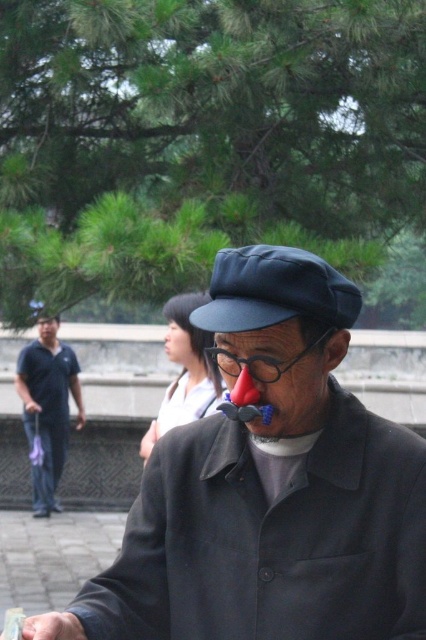
Which is behind, point (264, 540) or point (51, 504)?

The point (51, 504) is more distant.

Locate an element on the screen. The width and height of the screenshot is (426, 640). dark gray matte jacket at center is located at coordinates (270, 538).

Looking at this image, is dark gray matte jacket at center smaller than black fabric cap at center?

Result: No, dark gray matte jacket at center is not smaller than black fabric cap at center.

Is the position of dark gray matte jacket at center more distant than that of black fabric cap at center?

Yes, dark gray matte jacket at center is further from the viewer.

At what (x,y) coordinates should I click in order to perform the action: click on dark gray matte jacket at center. Please return your answer as a coordinate pair (x, y). The width and height of the screenshot is (426, 640). Looking at the image, I should click on (270, 538).

Is black fabric cap at center in front of matte blue jeans at left?

Yes.

Is point (255, 301) farther from viewer compared to point (43, 385)?

That is False.

This screenshot has height=640, width=426. I want to click on black fabric cap at center, so click(275, 291).